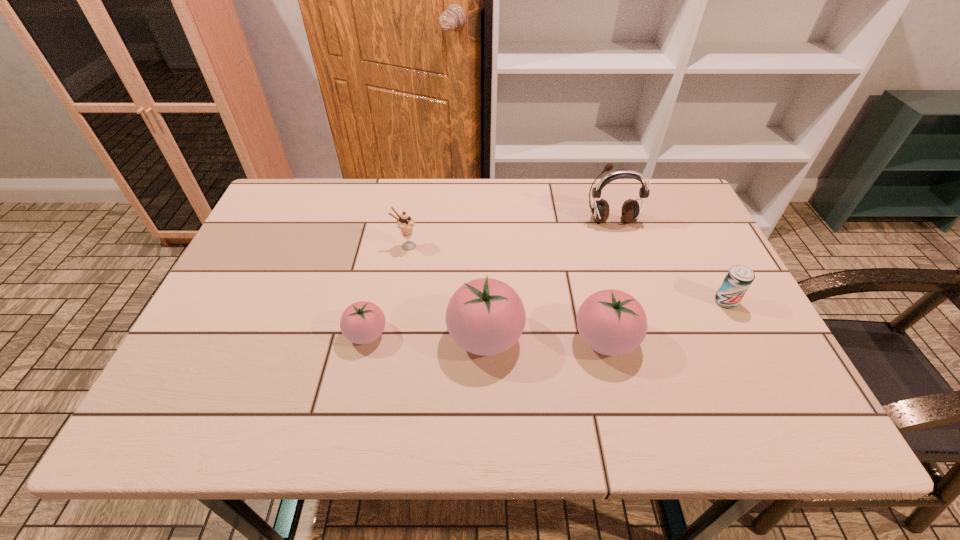
You are a GUI agent. You are given a task and a screenshot of the screen. Output one action in this format:
    pyautogui.click(x=<x>, y=<y>)
    Task: Click on the vacant region located 0.330m on the back of the second tallest tomato
    Image resolution: width=960 pixels, height=540 pixels.
    Given the screenshot: What is the action you would take?
    [578, 226]

Find the location of a particular element. Image resolution: width=960 pixels, height=540 pixels. vacant space located 0.290m on the left of the beer can is located at coordinates (596, 301).

Locate an element on the screen. vacant space located on the back of the icecream is located at coordinates (414, 203).

At what (x,y) coordinates should I click in order to perform the action: click on vacant space located on the ear pads of the tallest object. Please return your answer as a coordinate pair (x, y). The width and height of the screenshot is (960, 540). Looking at the image, I should click on click(627, 268).

This screenshot has width=960, height=540. Identify the location of object that is at the far edge. (630, 212).

You are a GUI agent. You are given a task and a screenshot of the screen. Output one action in this format:
    pyautogui.click(x=<x>, y=<y>)
    Task: Click on the object that is at the right edge
    The height and width of the screenshot is (540, 960).
    Given the screenshot: What is the action you would take?
    pyautogui.click(x=739, y=278)

The image size is (960, 540). Identify the location of free space at the far edge. (432, 202).

This screenshot has height=540, width=960. In order to click on vacant area at the near edge in this screenshot , I will do `click(317, 378)`.

I want to click on vacant position at the left edge of the desktop, so click(x=299, y=248).

Image resolution: width=960 pixels, height=540 pixels. In order to click on free space at the far left corner in this screenshot , I will do `click(332, 181)`.